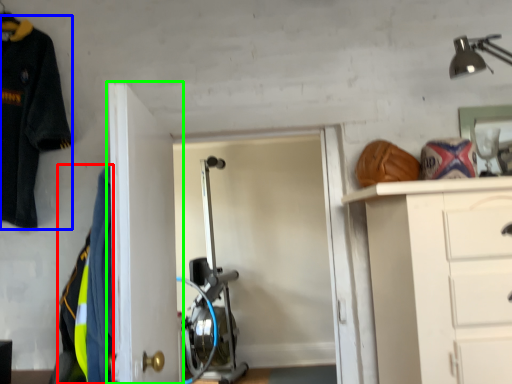
Question: Which object is positioned farthest from uniform (highlighted by a red box)? Select from uniform (highlighted by a blue box) and door (highlighted by a green box).

Choices:
 (A) uniform
 (B) door

Answer: (A)